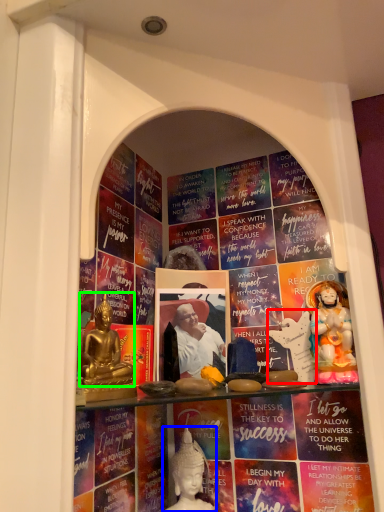
Question: Based on their relative distances, which object is nearer to sculpture (highlighted by a red box)? Choose from person (highlighted by a blue box) and person (highlighted by a green box).

Choices:
 (A) person
 (B) person

Answer: (A)